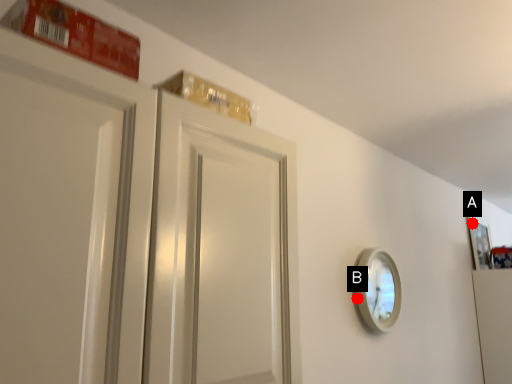
Question: Two points are circled on the image, labeled by A and B beside each circle. Which point is closer to the camera taking this photo?

Choices:
 (A) A is closer
 (B) B is closer

Answer: (B)